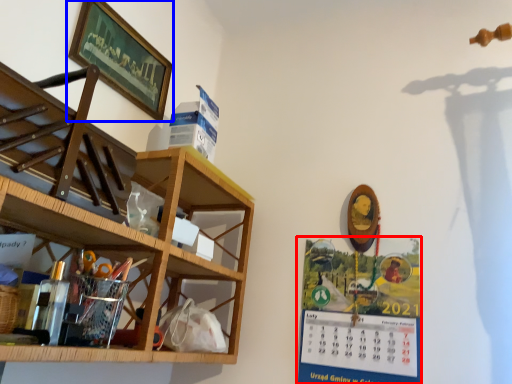
Question: Which object is further to the camera taking this photo, poster (highlighted by a red box) or picture frame (highlighted by a blue box)?

Choices:
 (A) poster
 (B) picture frame

Answer: (B)